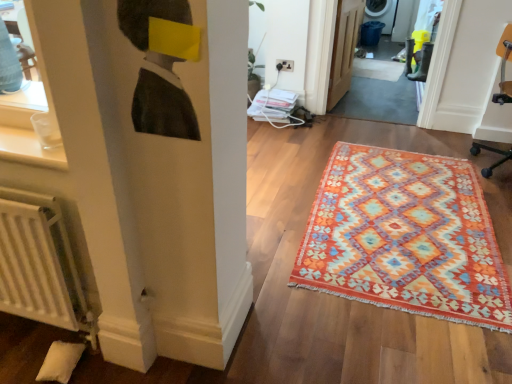
Where is `vacant space underneath orange fabric swivel chair at right (from a real-world perspective)`? This screenshot has height=384, width=512. vacant space underneath orange fabric swivel chair at right (from a real-world perspective) is located at coordinates (499, 165).